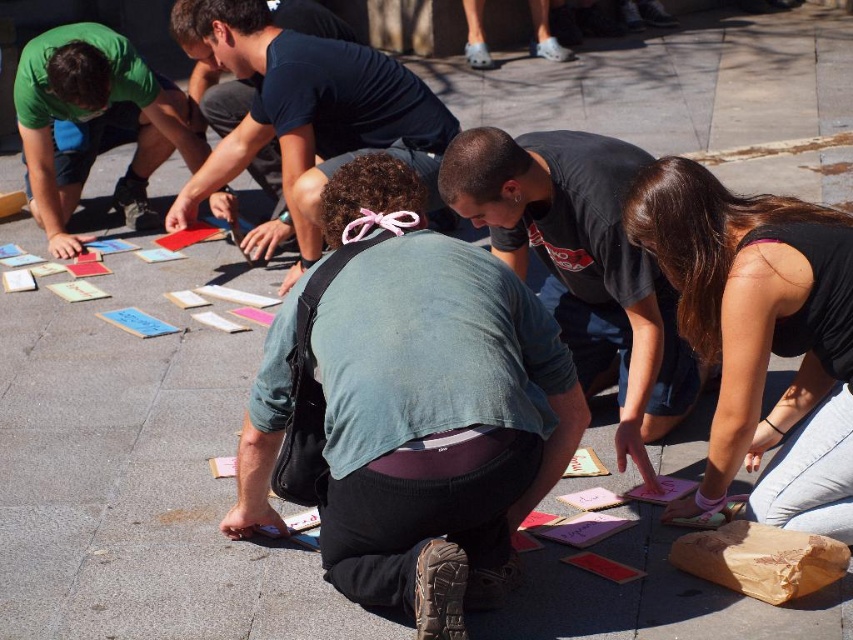
Question: Is dark gray t-shirt at center bigger than dark blue t-shirt at center?

Choices:
 (A) no
 (B) yes

Answer: (A)

Question: Considering the real-world distances, which object is closest to the black matte shirt at lower right?

Choices:
 (A) dark blue t-shirt at center
 (B) denim shirt at center

Answer: (B)

Question: Which object is the farthest from the dark blue t-shirt at center?

Choices:
 (A) green matte shirt at upper left
 (B) black matte shirt at lower right
 (C) dark gray t-shirt at center
 (D) cardboard pieces at center

Answer: (B)

Question: Is denim shirt at center to the left of cardboard pieces at center from the viewer's perspective?

Choices:
 (A) no
 (B) yes

Answer: (A)

Question: Is dark blue t-shirt at center smaller than green matte shirt at upper left?

Choices:
 (A) no
 (B) yes

Answer: (A)

Question: Which is nearer to the denim shirt at center?

Choices:
 (A) dark gray t-shirt at center
 (B) dark blue t-shirt at center
 (C) cardboard pieces at center
 (D) green matte shirt at upper left

Answer: (A)